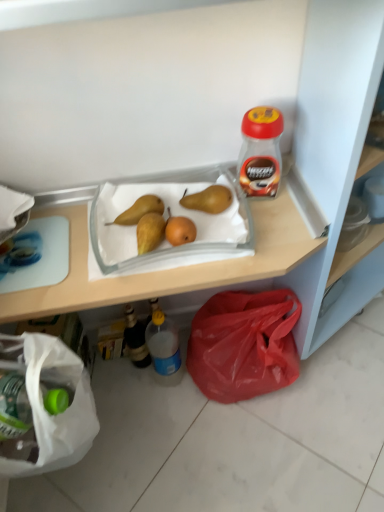
Identify the location of free space that is to the left of translucent glass bottle at lower left, which is counted as the 1th bottle, starting from the left. (106, 368).